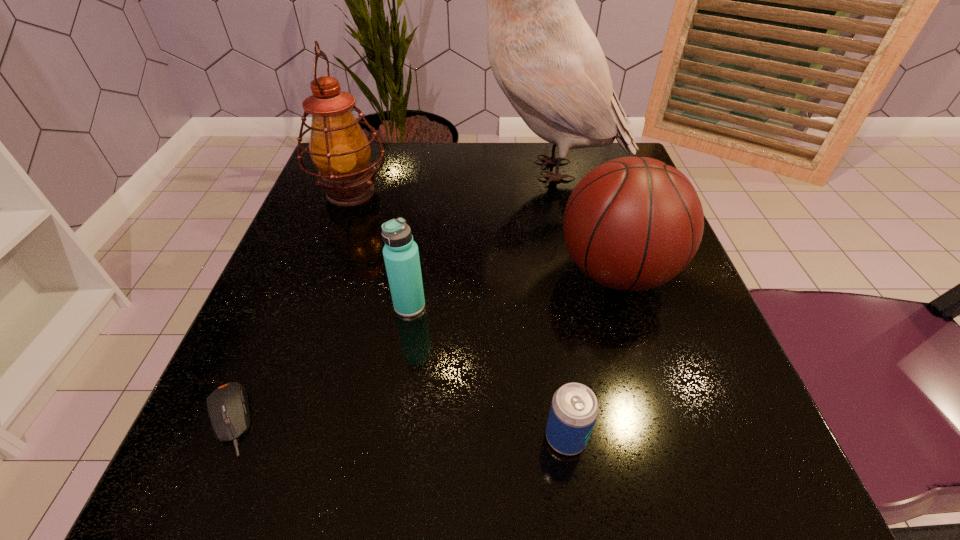
At what (x,y) coordinates should I click in order to perform the action: click on parakeet. Please return your answer as a coordinate pair (x, y). Looking at the image, I should click on (544, 56).

The image size is (960, 540). I want to click on oil lamp, so click(340, 150).

In order to click on the third tallest object in this screenshot , I will do `click(633, 223)`.

In order to click on thermos bottle in this screenshot , I will do `click(401, 255)`.

Image resolution: width=960 pixels, height=540 pixels. Identify the location of the fourth object from right to left. (401, 255).

Where is `beer can`? This screenshot has width=960, height=540. beer can is located at coordinates (574, 409).

I want to click on computer mouse, so click(228, 408).

This screenshot has height=540, width=960. I want to click on blank space located on the face of the tallest object, so click(365, 170).

Where is `vacant space located 0.290m on the face of the tallest object`? This screenshot has width=960, height=540. vacant space located 0.290m on the face of the tallest object is located at coordinates (333, 170).

Identify the location of blank space located 0.140m on the face of the tallest object. The image size is (960, 540). (400, 170).